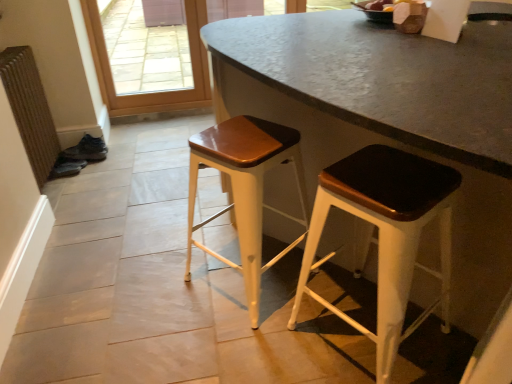
You are a GUI agent. You are given a task and a screenshot of the screen. Output one action in this format:
    pyautogui.click(x=<x>, y=<y>)
    Task: Click on the empty space that is ontop of wooden seat stool at center, the 1th stool when ordered from left to right (from a real-world perspective)
    This screenshot has height=384, width=512.
    Given the screenshot: What is the action you would take?
    click(x=247, y=134)